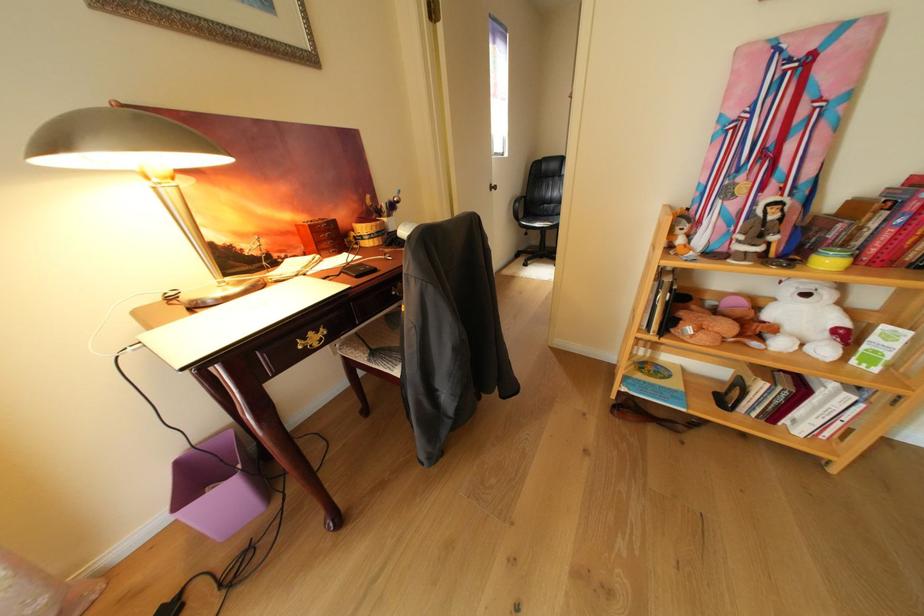
Find the location of `yellow lidded container`. yellow lidded container is located at coordinates (831, 259).